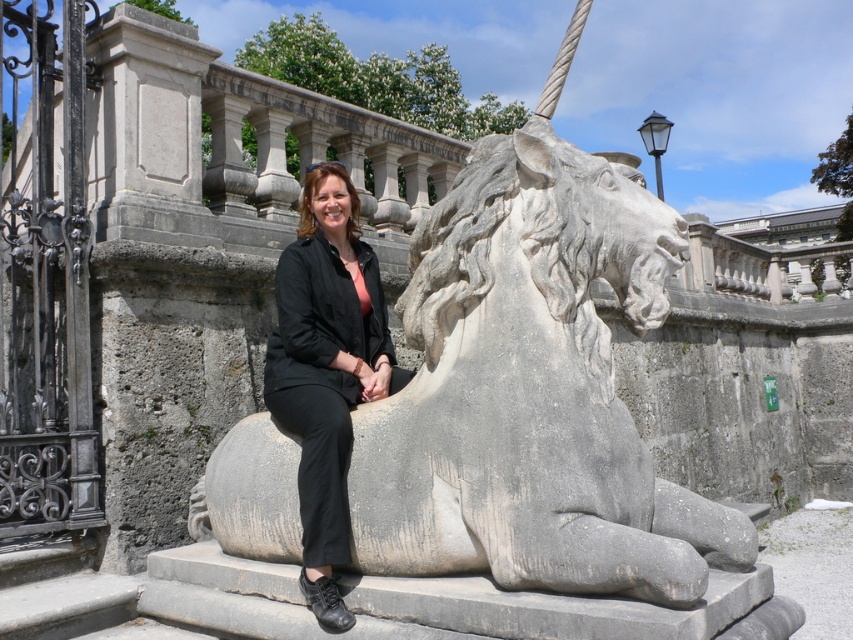
You are a photographer trying to capture the woman and the lion sculpture in the scene. Since the gray stone horse at center and the black fabric jacket at center are both at the center, which one should you focus on first to ensure they are both in sharp focus?

The gray stone horse at center is in front of the black fabric jacket at center, so you should focus on the gray stone horse at center first to ensure both are in sharp focus.

You are standing in a park and see a woman sitting on a large stone lion sculpture. There is a point at coordinates point (566, 280). Can you estimate how far this point is from you in meters?

The point (566, 280) is 9.23 meters away from the viewer.

You are a photographer trying to capture a photo of the gray stone horse at center and the black fabric jacket at center in the same frame. The minimum distance your camera can focus on two objects simultaneously is 5 feet. Will you be able to take the photo without moving either object?

The gray stone horse at center and black fabric jacket at center are 4.63 feet apart, which is within the camera focus range of 5 feet. Therefore, you can take the photo without moving either object.